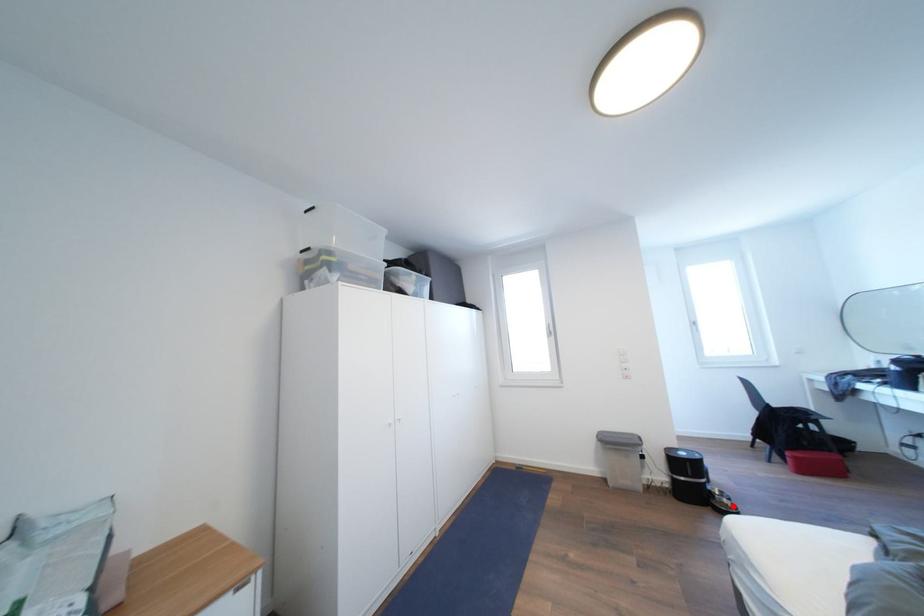
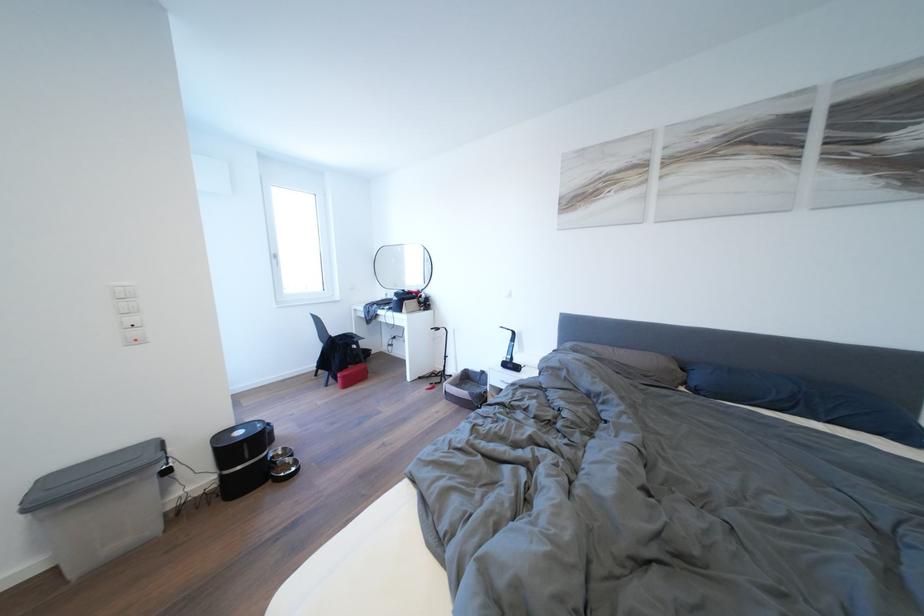
Find the pixel in the second image that matches the highlighted location in the first image.

(296, 466)